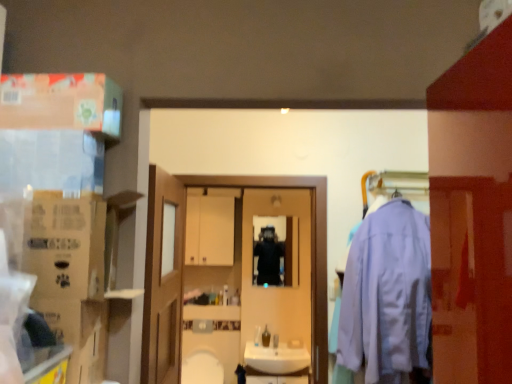
This screenshot has height=384, width=512. Describe the element at coordinates (79, 334) in the screenshot. I see `cardboard box at left, which is counted as the first cardboard box, starting from the bottom` at that location.

Measure the distance between white glossy sink at center and camera.

white glossy sink at center is 3.17 meters from camera.

The image size is (512, 384). Describe the element at coordinates (61, 102) in the screenshot. I see `matte cardboard box at upper left` at that location.

Locate an element on the screen. The image size is (512, 384). wooden door at center is located at coordinates (163, 279).

Measure the distance between point (173, 309) and camera.

Point (173, 309) is 2.07 meters from camera.

What do you see at coordinates (286, 267) in the screenshot? This screenshot has height=384, width=512. I see `white glossy mirror at center` at bounding box center [286, 267].

This screenshot has height=384, width=512. Find the location of `brown cardboard box at left, which is the 2th cardboard box from bottom to top`. brown cardboard box at left, which is the 2th cardboard box from bottom to top is located at coordinates (66, 246).

Considering the positions of points (297, 273) and (229, 196), is point (297, 273) closer to camera compared to point (229, 196)?

No, (297, 273) is further to viewer.

In the scene shown: Is white matte cabinet at center at the back of white glossy mirror at center?

Yes, white glossy mirror at center is facing away from white matte cabinet at center.

In the scene shown: Who is shorter, white glossy mirror at center or white matte cabinet at center?

white matte cabinet at center is shorter.

Can you tell me how much white glossy mirror at center and white matte cabinet at center differ in facing direction?

The angular difference between white glossy mirror at center and white matte cabinet at center is 1.11 degrees.

Is matte cardboard box at upper left completely or partially outside of black matte jacket at center?

matte cardboard box at upper left lies outside black matte jacket at center's area.

Considering the sizes of objects matte cardboard box at upper left and black matte jacket at center in the image provided, who is wider, matte cardboard box at upper left or black matte jacket at center?

Wider between the two is matte cardboard box at upper left.

Considering the positions of objects matte cardboard box at upper left and black matte jacket at center in the image provided, who is more to the right, matte cardboard box at upper left or black matte jacket at center?

black matte jacket at center.

Which point is more forward, (364, 239) or (217, 221)?

The point (364, 239) is more forward.

Is light blue fabric sweatshirt at right turned away from white matte cabinet at center?

No.

From their relative heights in the image, would you say light blue fabric sweatshirt at right is taller or shorter than white matte cabinet at center?

Considering their sizes, light blue fabric sweatshirt at right has more height than white matte cabinet at center.

Does light blue fabric sweatshirt at right have a greater width compared to white matte cabinet at center?

Correct, the width of light blue fabric sweatshirt at right exceeds that of white matte cabinet at center.

From the image's perspective, which is above, white glossy mirror at center or matte cardboard box at upper left?

From the image's view, matte cardboard box at upper left is above.

Considering the sizes of white glossy mirror at center and matte cardboard box at upper left in the image, is white glossy mirror at center bigger or smaller than matte cardboard box at upper left?

Clearly, white glossy mirror at center is larger in size than matte cardboard box at upper left.

From a real-world perspective, which object rests below the other?

white glossy mirror at center is physically lower.

Between point (294, 230) and point (35, 128), which one is positioned in front?

Positioned in front is point (35, 128).

Looking at this image, does white glossy mirror at center appear on the left side of black matte jacket at center?

Indeed, white glossy mirror at center is positioned on the left side of black matte jacket at center.

Is point (251, 290) closer or farther from the camera than point (275, 258)?

Point (251, 290) is positioned closer to the camera compared to point (275, 258).

Is white glossy mirror at center aimed at black matte jacket at center?

No, white glossy mirror at center does not turn towards black matte jacket at center.

From the image's perspective, is white glossy mirror at center above black matte jacket at center?

Indeed, from the image's perspective, white glossy mirror at center is shown above black matte jacket at center.

In terms of size, does brown cardboard box at left, which is the 2th cardboard box from bottom to top, appear bigger or smaller than wooden door at center?

In the image, brown cardboard box at left, which is the 2th cardboard box from bottom to top, appears to be smaller than wooden door at center.

Is brown cardboard box at left, which is counted as the 1th cardboard box, starting from the top, touching wooden door at center?

No, brown cardboard box at left, which is counted as the 1th cardboard box, starting from the top, is not next to wooden door at center.

Which of these two, brown cardboard box at left, which is counted as the 1th cardboard box, starting from the top, or wooden door at center, stands shorter?

brown cardboard box at left, which is counted as the 1th cardboard box, starting from the top, is shorter.

Considering the relative positions of cardboard box at left, which is counted as the first cardboard box, starting from the bottom, and wooden door at center in the image provided, is cardboard box at left, which is counted as the first cardboard box, starting from the bottom, to the left of wooden door at center from the viewer's perspective?

Yes, cardboard box at left, which is counted as the first cardboard box, starting from the bottom, is to the left of wooden door at center.

Can you confirm if cardboard box at left, which is counted as the first cardboard box, starting from the bottom, is taller than wooden door at center?

Incorrect, the height of cardboard box at left, which is counted as the first cardboard box, starting from the bottom, is not larger of that of wooden door at center.

Is cardboard box at left, which is counted as the first cardboard box, starting from the bottom, far from wooden door at center?

No.

Is cardboard box at left, which is counted as the first cardboard box, starting from the bottom, thinner than wooden door at center?

No, cardboard box at left, which is counted as the first cardboard box, starting from the bottom, is not thinner than wooden door at center.

There is a white glossy mirror at center. Find the location of `cabinetry above it (from a real-world perspective)`. cabinetry above it (from a real-world perspective) is located at coordinates coord(209,229).

The image size is (512, 384). What are the coordinates of `person on the right of matte cardboard box at upper left` in the screenshot? It's located at (268, 257).

From the image, which object appears to be nearer to light blue fabric sweatshirt at right, white matte cabinet at center or matte cardboard box at upper left?

Among the two, matte cardboard box at upper left is located nearer to light blue fabric sweatshirt at right.

Consider the image. Considering their positions, is brown cardboard box at left, which is counted as the 1th cardboard box, starting from the top, positioned further to black matte jacket at center than cardboard box at left, which is counted as the first cardboard box, starting from the bottom?

Based on the image, brown cardboard box at left, which is counted as the 1th cardboard box, starting from the top, appears to be further to black matte jacket at center.

Estimate the real-world distances between objects in this image. Which object is further from cardboard box at left, marked as the second cardboard box in a top-to-bottom arrangement, white glossy sink at center or black matte jacket at center?

black matte jacket at center is positioned further to the anchor cardboard box at left, marked as the second cardboard box in a top-to-bottom arrangement.

Considering their positions, is brown cardboard box at left, which is the 2th cardboard box from bottom to top, positioned further to white glossy mirror at center than wooden door at center?

brown cardboard box at left, which is the 2th cardboard box from bottom to top.

Based on their spatial positions, is brown cardboard box at left, which is counted as the 1th cardboard box, starting from the top, or white glossy sink at center further from light blue fabric sweatshirt at right?

brown cardboard box at left, which is counted as the 1th cardboard box, starting from the top.

Looking at the image, which one is located closer to matte cardboard box at upper left, wooden door at center or cardboard box at left, which is counted as the first cardboard box, starting from the bottom?

The object closer to matte cardboard box at upper left is cardboard box at left, which is counted as the first cardboard box, starting from the bottom.

In the scene shown: From the image, which object appears to be farther from wooden door at center, white glossy sink at center or white matte cabinet at center?

The object further to wooden door at center is white glossy sink at center.

From the picture: When comparing their distances from cardboard box at left, marked as the second cardboard box in a top-to-bottom arrangement, does wooden door at center or light blue fabric sweatshirt at right seem further?

light blue fabric sweatshirt at right.

The height and width of the screenshot is (384, 512). I want to click on box positioned between brown cardboard box at left, which is counted as the 1th cardboard box, starting from the top, and white matte cabinet at center from near to far, so click(61, 102).

Find the location of a particular element. The height and width of the screenshot is (384, 512). box between cardboard box at left, marked as the second cardboard box in a top-to-bottom arrangement, and white glossy mirror at center, along the z-axis is located at coordinates (61, 102).

Where is `sink located between matte cardboard box at upper left and white matte cabinet at center in the depth direction`? sink located between matte cardboard box at upper left and white matte cabinet at center in the depth direction is located at coordinates coord(277,362).

Identify the location of door located between cardboard box at left, marked as the second cardboard box in a top-to-bottom arrangement, and black matte jacket at center in the depth direction. (163, 279).